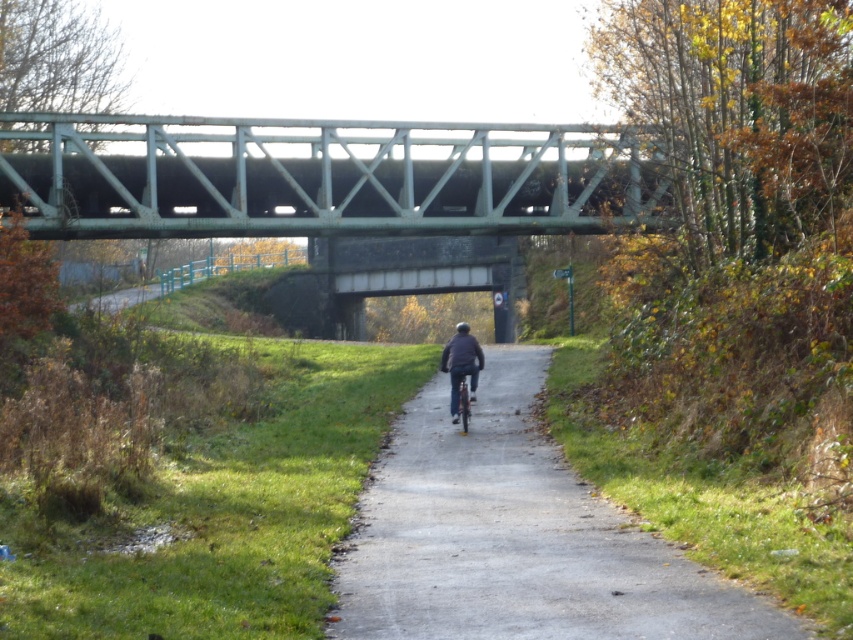
You are a delivery person who needs to place a package on the ground near the dark blue jacket at center without blocking the smooth asphalt path at center. Given that the package is 2 feet wide, is there enough space between them to do so?

The smooth asphalt path at center and dark blue jacket at center are 17.27 feet apart from each other. Since the package is only 2 feet wide, there is sufficient space between them to place the package without blocking the path.

You are a delivery person who needs to deliver a package to the end of the path. You have a cart that is 3 feet wide. The cart can only be placed on the path. Can you safely place your cart on the smooth asphalt path at center without it going off the path? The metallic silver bicycle at center is in the way. Is there enough space between the bicycle and the path to place your cart?

The smooth asphalt path at center and metallic silver bicycle at center are 9.44 feet apart. Since the cart is 3 feet wide, there is sufficient space between them to place the cart safely on the path without it going off, as 9.44 feet is greater than 3 feet.

You are a pedestrian walking on the path and notice the dark blue jacket at center and the metallic silver bicycle at center. Which object is closer to you?

The dark blue jacket at center is positioned over the metallic silver bicycle at center, so the dark blue jacket at center is closer to you.